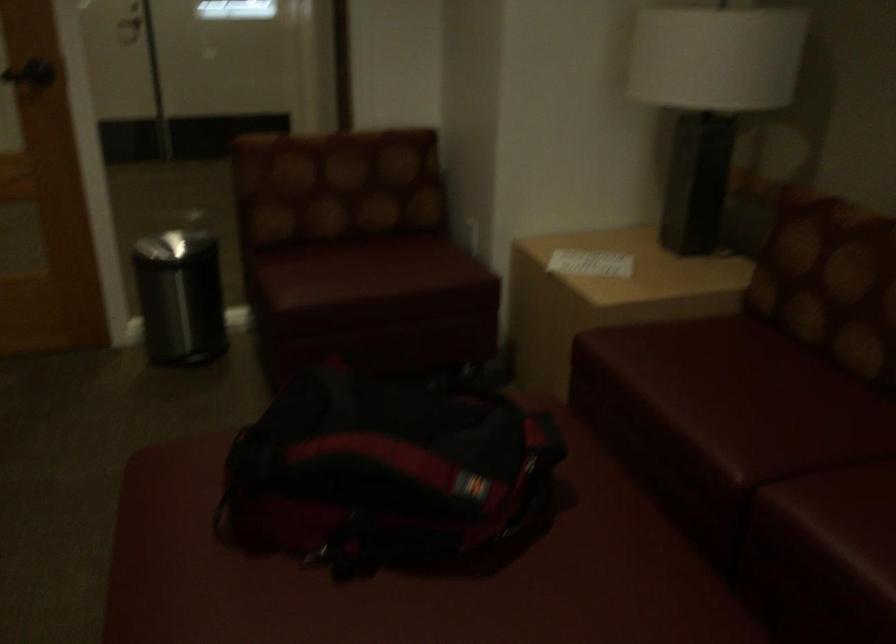
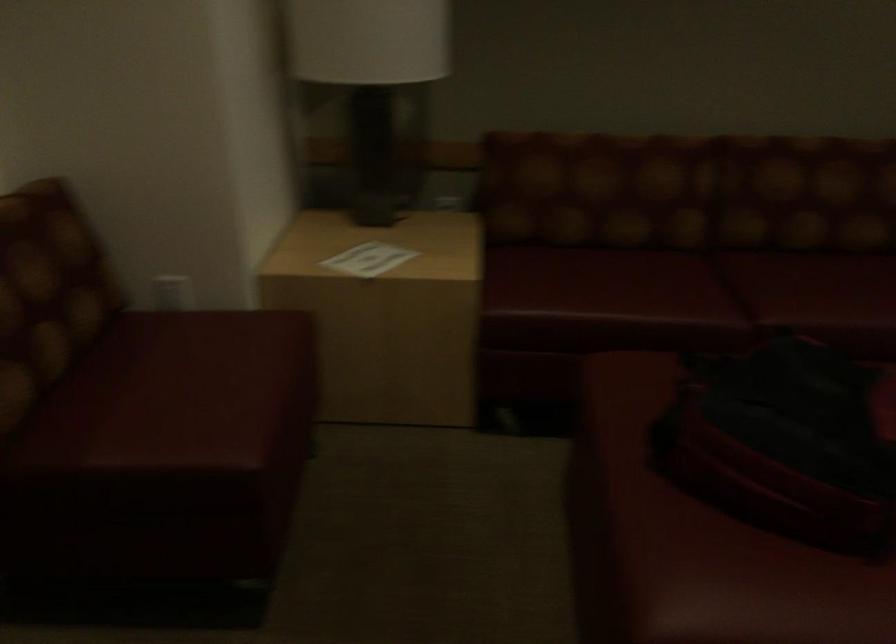
In the second image, find the point that corresponds to (x=309, y=430) in the first image.

(786, 442)